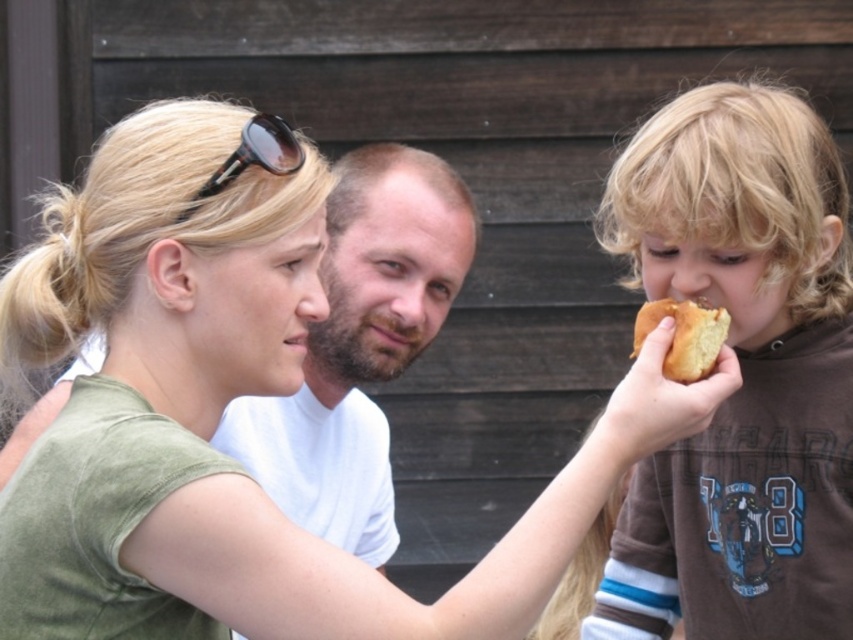
Does matte green shirt at center come behind black plastic sunglasses at upper center?

No, it is in front of black plastic sunglasses at upper center.

Between point (38, 564) and point (286, 152), which one is positioned in front?

Point (38, 564)

The height and width of the screenshot is (640, 853). I want to click on matte green shirt at center, so click(x=222, y=412).

Can you confirm if brown soft bread at right is taller than black plastic sunglasses at upper center?

Correct, brown soft bread at right is much taller as black plastic sunglasses at upper center.

Which is more to the right, brown soft bread at right or black plastic sunglasses at upper center?

From the viewer's perspective, brown soft bread at right appears more on the right side.

This screenshot has width=853, height=640. What do you see at coordinates (741, 372) in the screenshot?
I see `brown soft bread at right` at bounding box center [741, 372].

The image size is (853, 640). What are the coordinates of `brown soft bread at right` in the screenshot? It's located at (741, 372).

In order to click on matte green shirt at center in this screenshot , I will do `click(222, 412)`.

Is matte green shirt at center to the left of brown soft bread at right from the viewer's perspective?

Indeed, matte green shirt at center is positioned on the left side of brown soft bread at right.

What do you see at coordinates (222, 412) in the screenshot? I see `matte green shirt at center` at bounding box center [222, 412].

Image resolution: width=853 pixels, height=640 pixels. What are the coordinates of `matte green shirt at center` in the screenshot? It's located at (222, 412).